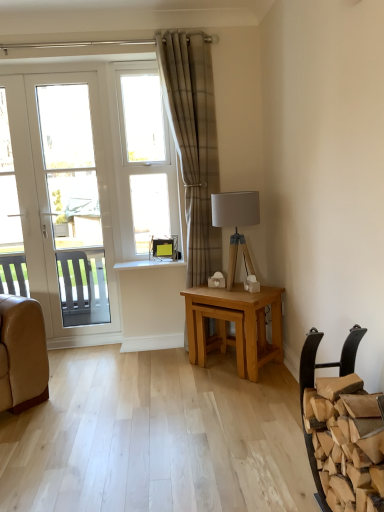
Question: From their relative heights in the image, would you say white plastic window at center is taller or shorter than matte gray fabric lampshade at right?

Choices:
 (A) short
 (B) tall

Answer: (B)

Question: Considering the positions of white plastic window at center and matte gray fabric lampshade at right in the image, is white plastic window at center wider or thinner than matte gray fabric lampshade at right?

Choices:
 (A) thin
 (B) wide

Answer: (A)

Question: Which is farther from the matte gray fabric lampshade at right?

Choices:
 (A) plaid fabric curtain at center
 (B) white glossy door at left
 (C) light oak wooden table at center
 (D) brown leather chair at lower right
 (E) white plastic window at center

Answer: (B)

Question: Which object is the closest to the white plastic window at center?

Choices:
 (A) white glossy door at left
 (B) light oak wooden table at center
 (C) brown leather chair at lower right
 (D) plaid fabric curtain at center
 (E) matte gray fabric lampshade at right

Answer: (D)